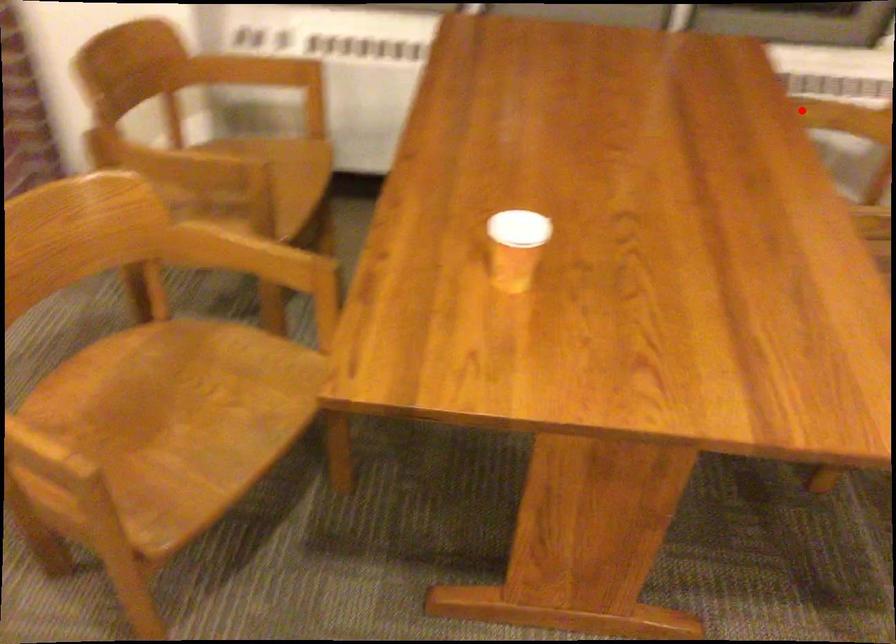
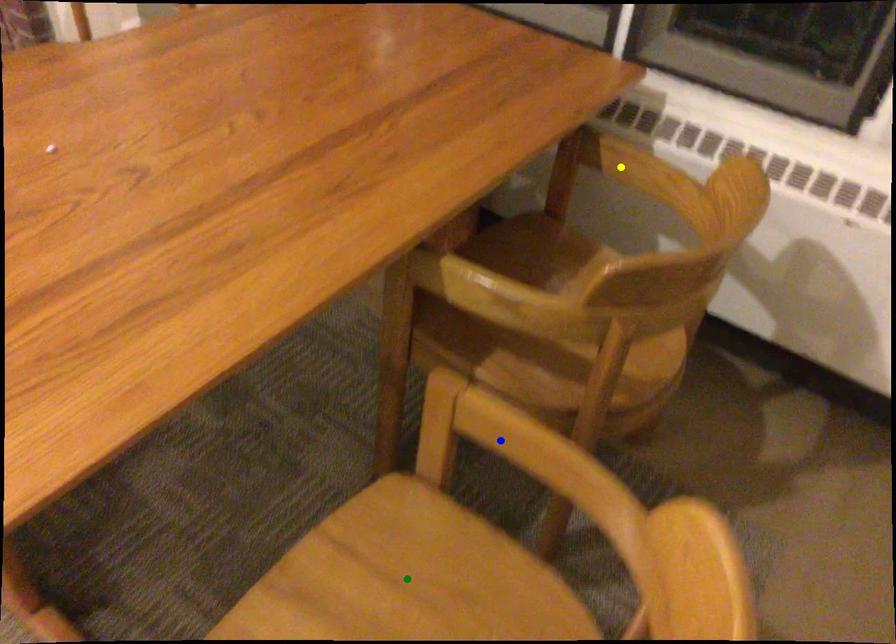
Question: I am providing you with two images of the same scene from different viewpoints. A red point is marked on the first image. You are given multiple points on the second image. Can you choose the point in image 2 that corresponds to the point in image 1?

Choices:
 (A) blue point
 (B) green point
 (C) yellow point

Answer: (C)